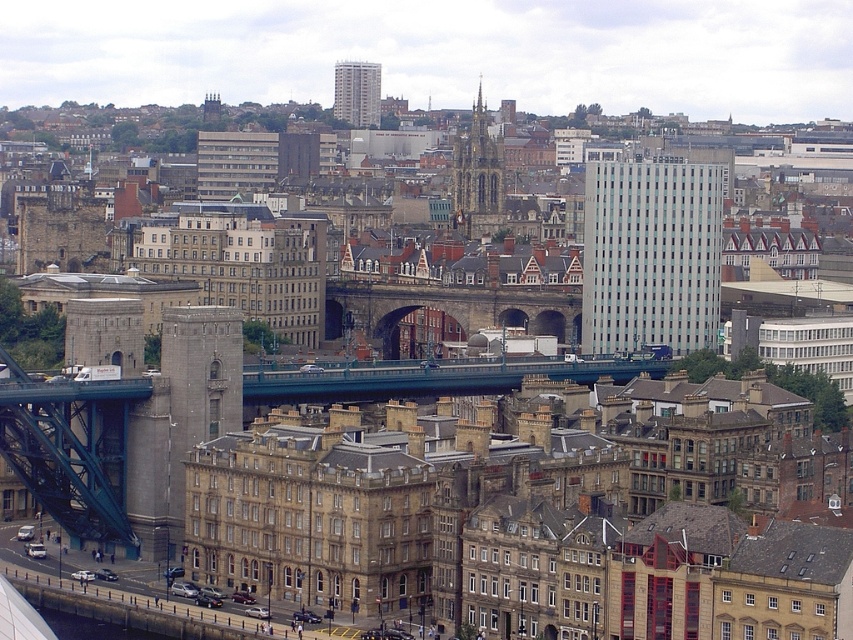
You are a drone operator tasked with capturing aerial footage of the gray concrete building at center right and the blue metallic bridge at center. Your drone has a limited battery life and can only fly over one of the two structures. Based on their positions, which structure should you choose to ensure the drone can capture both without crossing over any obstacles?

The gray concrete building at center right is positioned over the blue metallic bridge at center, so you should choose to fly over the blue metallic bridge at center first. This way, the drone can capture the bridge and then ascend to capture the building above it without needing to cross over any obstacles between them.

You are a city planner analyzing the cityscape. You need to determine the spatial relationship between the brown stone bridge at center and the light gray concrete building at upper center. Based on the image, which object is positioned higher in the scene?

The light gray concrete building at upper center is positioned higher in the scene than the brown stone bridge at center.

You are a city planner analyzing the bridges in the scene. Which bridge, the blue metallic bridge at center or the brown stone bridge at center, has a lower height?

The blue metallic bridge at center is not as tall as the brown stone bridge at center, so the blue metallic bridge at center has a lower height.